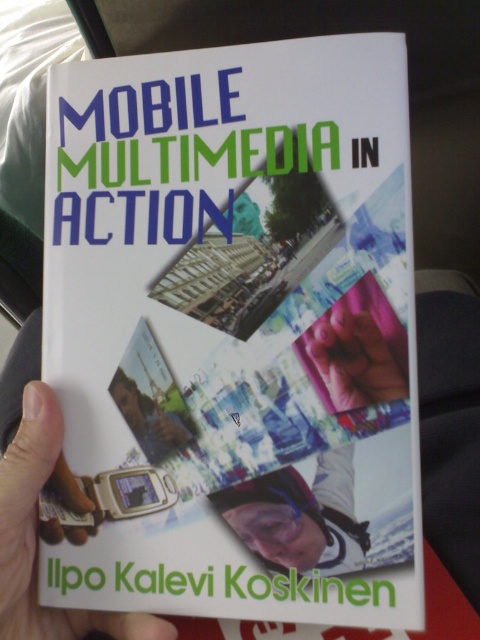
Question: Which point is closer to the camera?

Choices:
 (A) white matte book at center
 (B) white matte phone at lower left
 (C) matte black helmet at center

Answer: (A)

Question: Which object is the closest to the white matte phone at lower left?

Choices:
 (A) white matte book at center
 (B) matte plastic phone at lower left

Answer: (B)

Question: Which of the following is the farthest from the observer?

Choices:
 (A) (244, 115)
 (B) (303, 492)
 (C) (37, 604)

Answer: (A)

Question: Is the position of white matte book at center more distant than that of matte black helmet at center?

Choices:
 (A) yes
 (B) no

Answer: (B)

Question: Is white matte book at center below matte black helmet at center?

Choices:
 (A) no
 (B) yes

Answer: (A)

Question: Is white matte book at center further to camera compared to matte black helmet at center?

Choices:
 (A) yes
 (B) no

Answer: (B)